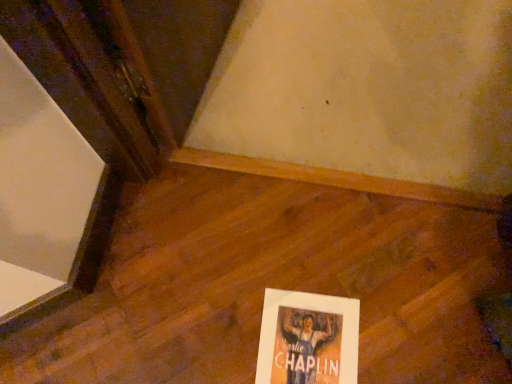
You are a GUI agent. You are given a task and a screenshot of the screen. Output one action in this format:
    pyautogui.click(x=<x>, y=<y>)
    Task: Click on the free location to the right of matte paper poster at lower right
    
    Given the screenshot: What is the action you would take?
    pyautogui.click(x=409, y=329)